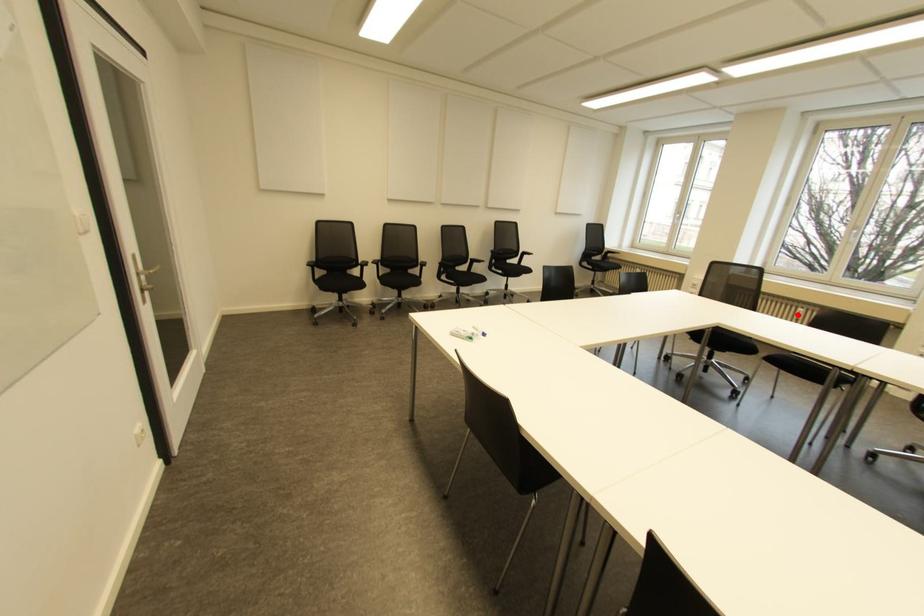
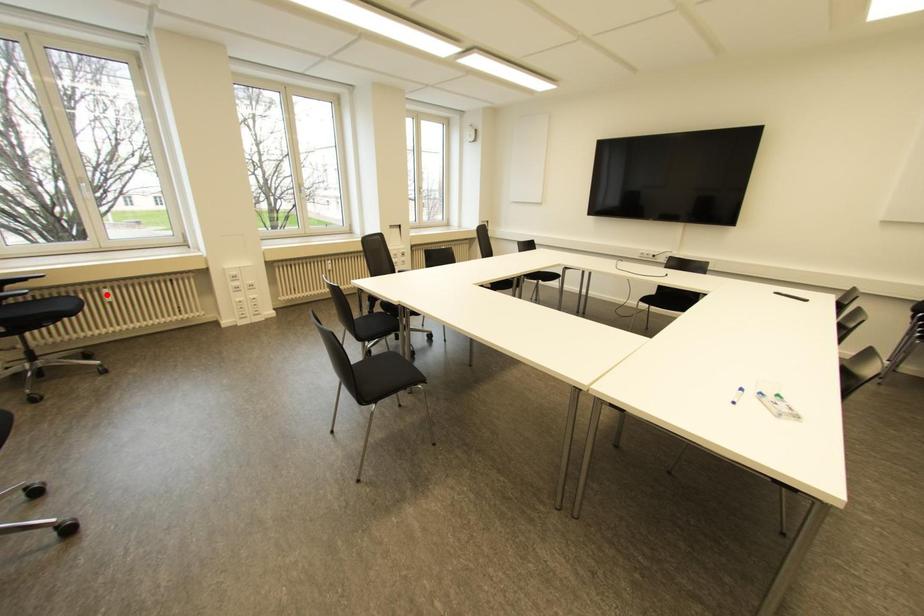
I am providing you with two images of the same scene from different viewpoints. A red point is marked on the first image and another point is marked on the second image. Is the red point in image1 aligned with the point shown in image2?

No